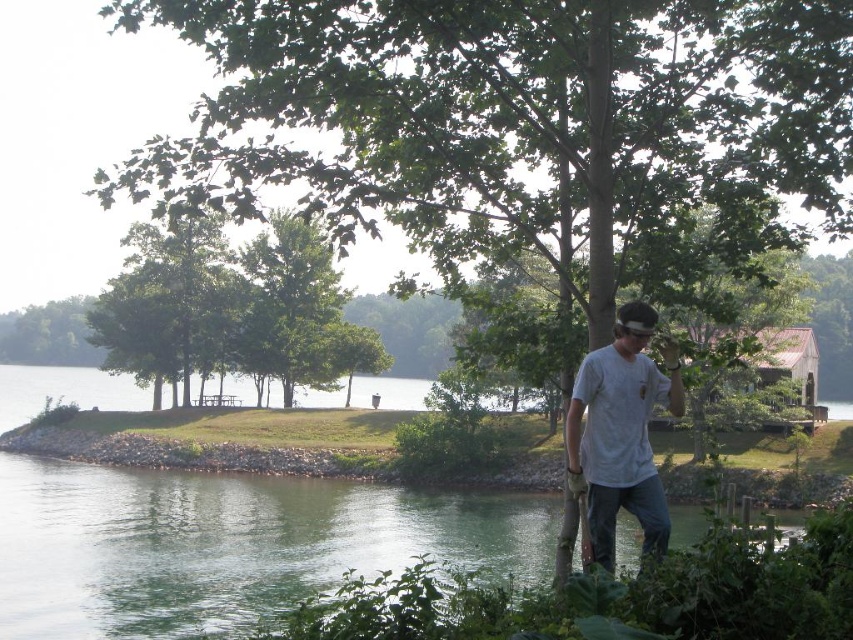
Is clear water at lower left below gray cotton t-shirt at center?

Yes, clear water at lower left is below gray cotton t-shirt at center.

Is clear water at lower left smaller than gray cotton t-shirt at center?

Actually, clear water at lower left might be larger than gray cotton t-shirt at center.

Where is `clear water at lower left`? This screenshot has width=853, height=640. clear water at lower left is located at coordinates (225, 545).